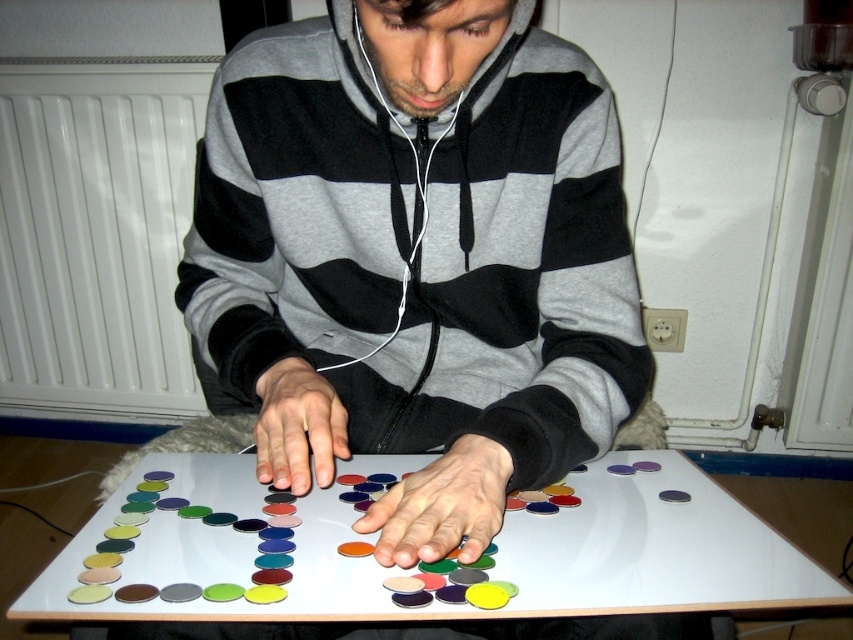
You are a visitor observing the scene. You notice two objects labeled as matte plastic hands at center and matte plastic hand at center. Which one is bigger?

The matte plastic hands at center is larger in size than the matte plastic hand at center.

You are a delivery robot that needs to place a package on the white glossy table at center. The robot can only move in straight lines from its current position at point 0.7, 0.6. Can it reach the table without any obstacles?

The white glossy table at center is located at point (x=498, y=552). Since the robot is at point (x=511, y=448), the straight line path between these two points would be unobstructed, so yes, the robot can reach the table.

You are standing in the room and want to place a small heater next to the white matte radiator at left. Where should you place it?

The white matte radiator at left is located at point (96, 236), so you should place the small heater near that coordinate to be next to it.